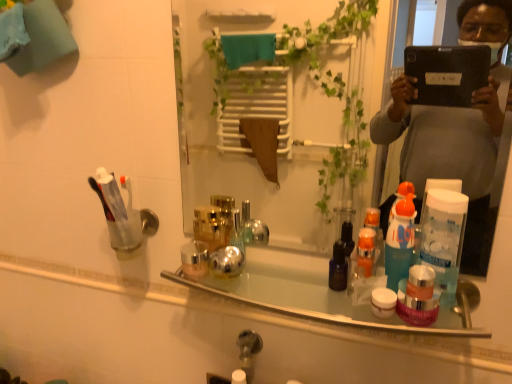
Question: Would you say shiny metallic bottles at center is to the left or to the right of clear glass mirror at center in the picture?

Choices:
 (A) left
 (B) right

Answer: (A)

Question: In terms of height, does shiny metallic bottles at center look taller or shorter compared to clear glass mirror at center?

Choices:
 (A) tall
 (B) short

Answer: (B)

Question: Based on their relative distances, which object is nearer to the shiny metallic bottles at center?

Choices:
 (A) clear plastic cup at left
 (B) clear glass mirror at center

Answer: (A)

Question: Estimate the real-world distances between objects in this image. Which object is closer to the clear plastic cup at left?

Choices:
 (A) shiny metallic bottles at center
 (B) clear glass mirror at center

Answer: (A)